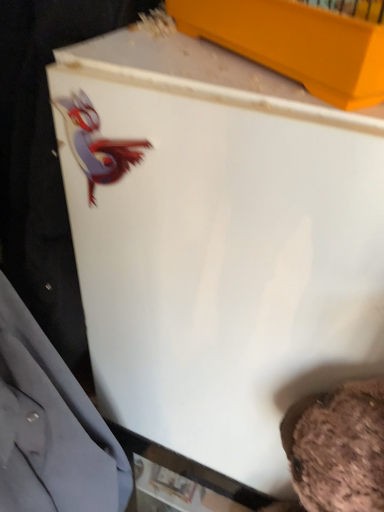
Question: Is matte gray dress shirt at left not inside matte yellow box at upper center?

Choices:
 (A) yes
 (B) no

Answer: (A)

Question: Considering the relative sizes of matte gray dress shirt at left and matte yellow box at upper center in the image provided, is matte gray dress shirt at left smaller than matte yellow box at upper center?

Choices:
 (A) no
 (B) yes

Answer: (A)

Question: From the image's perspective, is matte gray dress shirt at left over matte yellow box at upper center?

Choices:
 (A) yes
 (B) no

Answer: (B)

Question: Is matte gray dress shirt at left surrounding matte yellow box at upper center?

Choices:
 (A) yes
 (B) no

Answer: (B)

Question: Is matte gray dress shirt at left at the left side of matte yellow box at upper center?

Choices:
 (A) yes
 (B) no

Answer: (A)

Question: Does matte gray dress shirt at left have a greater height compared to matte yellow box at upper center?

Choices:
 (A) yes
 (B) no

Answer: (A)

Question: Can you confirm if matte yellow box at upper center is shorter than matte gray dress shirt at left?

Choices:
 (A) yes
 (B) no

Answer: (A)

Question: From the image's perspective, does matte yellow box at upper center appear higher than matte gray dress shirt at left?

Choices:
 (A) yes
 (B) no

Answer: (A)

Question: From a real-world perspective, is matte yellow box at upper center physically below matte gray dress shirt at left?

Choices:
 (A) yes
 (B) no

Answer: (B)

Question: Considering the relative positions of matte yellow box at upper center and matte gray dress shirt at left in the image provided, is matte yellow box at upper center to the left of matte gray dress shirt at left from the viewer's perspective?

Choices:
 (A) yes
 (B) no

Answer: (B)

Question: Is matte yellow box at upper center positioned with its back to matte gray dress shirt at left?

Choices:
 (A) yes
 (B) no

Answer: (B)

Question: From a real-world perspective, does matte yellow box at upper center stand above matte gray dress shirt at left?

Choices:
 (A) yes
 (B) no

Answer: (A)

Question: From a real-world perspective, is matte yellow box at upper center above or below matte gray dress shirt at left?

Choices:
 (A) below
 (B) above

Answer: (B)